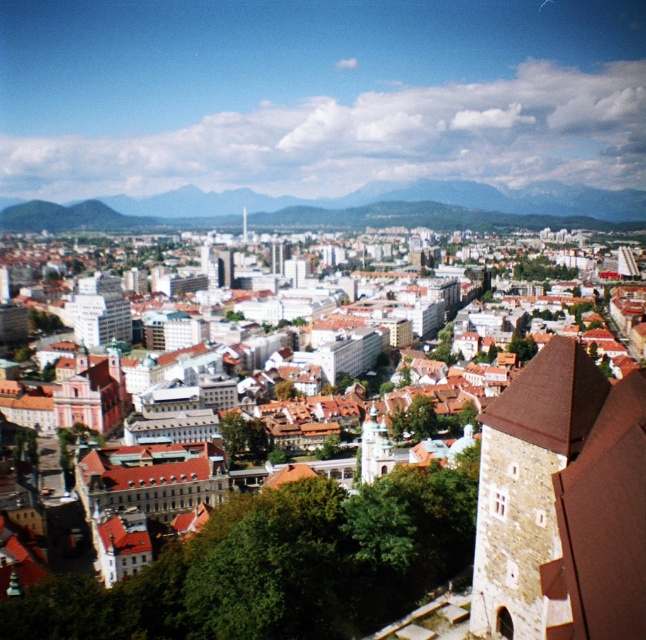
Question: Among these points, which one is nearest to the camera?

Choices:
 (A) (601, 225)
 (B) (512, 525)

Answer: (B)

Question: Does brown stone tower at right appear on the right side of green grassy hill at center?

Choices:
 (A) no
 (B) yes

Answer: (B)

Question: Is brown stone tower at right wider than green grassy hill at center?

Choices:
 (A) no
 (B) yes

Answer: (A)

Question: Can you confirm if brown stone tower at right is positioned to the left of green grassy hill at center?

Choices:
 (A) yes
 (B) no

Answer: (B)